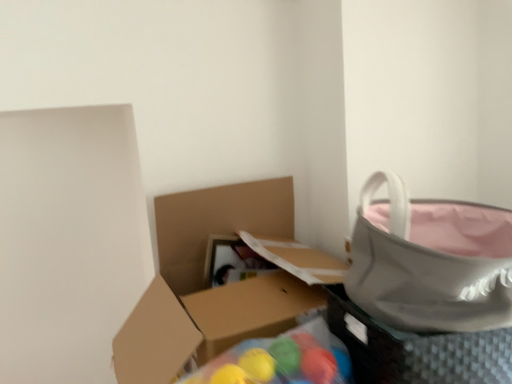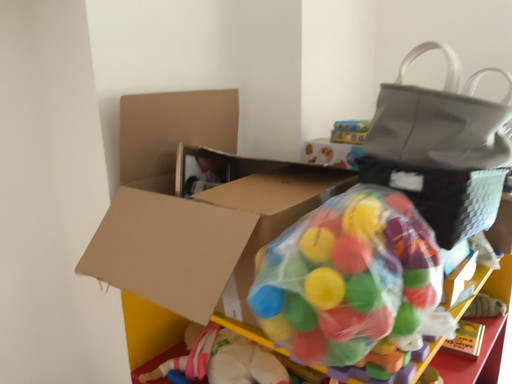
Question: How did the camera likely rotate when shooting the video?

Choices:
 (A) rotated right
 (B) rotated left

Answer: (A)